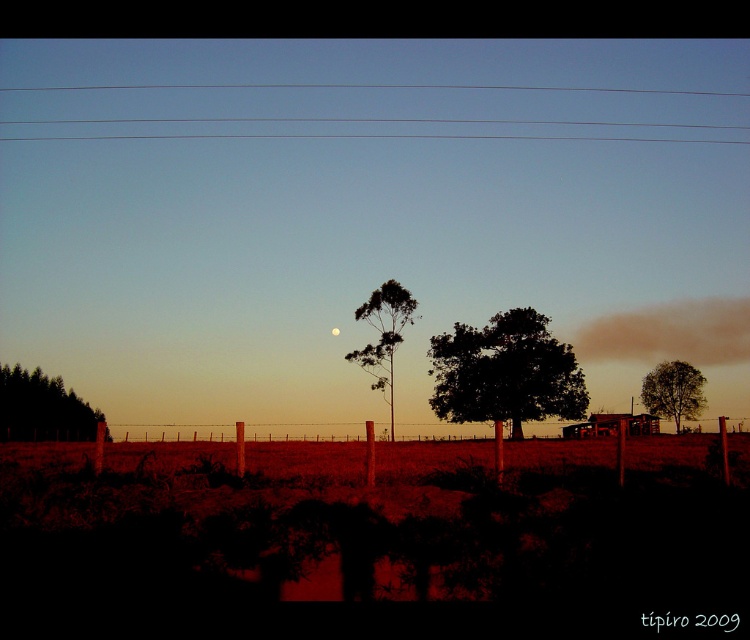
Is dark green leafy tree at center wider than green leafy tree at center?

Indeed, dark green leafy tree at center has a greater width compared to green leafy tree at center.

Can you confirm if dark green leafy tree at center is bigger than green leafy tree at center?

Indeed, dark green leafy tree at center has a larger size compared to green leafy tree at center.

Is point (468, 342) positioned in front of point (358, 355)?

Yes, point (468, 342) is in front of point (358, 355).

You are a GUI agent. You are given a task and a screenshot of the screen. Output one action in this format:
    pyautogui.click(x=<x>, y=<y>)
    Task: Click on the dark green leafy tree at center
    
    Given the screenshot: What is the action you would take?
    pyautogui.click(x=506, y=372)

Does point (3, 392) come in front of point (666, 378)?

Yes, it is in front of point (666, 378).

What are the coordinates of `green matte trees at left` in the screenshot? It's located at (42, 406).

Is green leafy tree at center to the right of satin silver moon at center from the viewer's perspective?

Indeed, green leafy tree at center is positioned on the right side of satin silver moon at center.

Is green leafy tree at center positioned in front of satin silver moon at center?

Yes, it is in front of satin silver moon at center.

Does point (408, 305) come in front of point (336, 333)?

Yes, point (408, 305) is closer to viewer.

You are a GUI agent. You are given a task and a screenshot of the screen. Output one action in this format:
    pyautogui.click(x=<x>, y=<y>)
    Task: Click on the green leafy tree at center
    
    Given the screenshot: What is the action you would take?
    pyautogui.click(x=384, y=336)